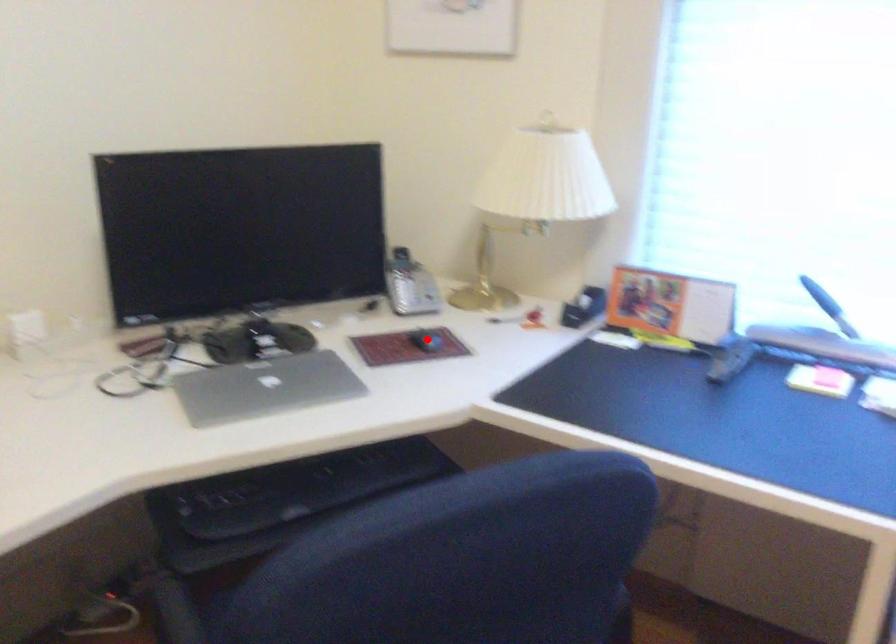
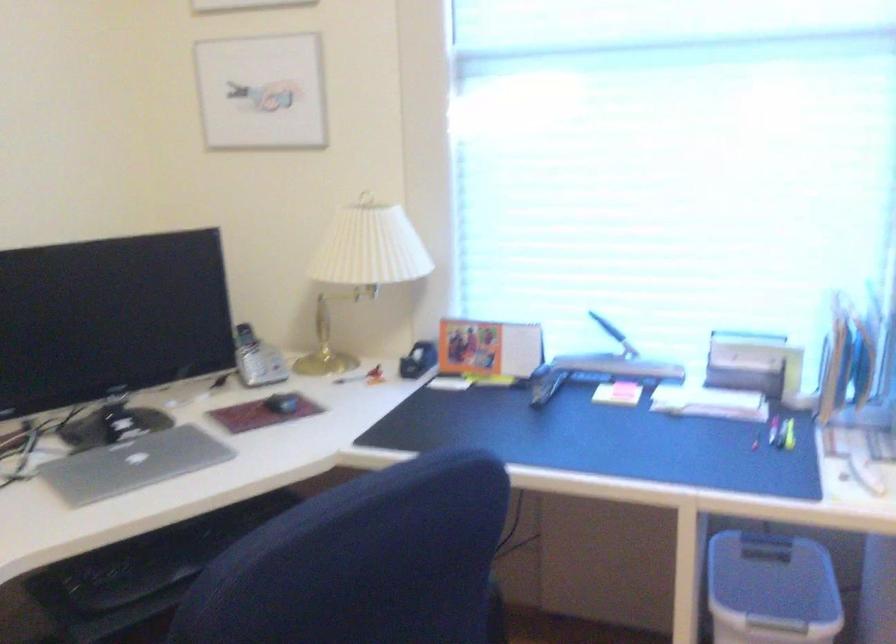
In the second image, find the point that corresponds to the highlighted location in the first image.

(281, 402)